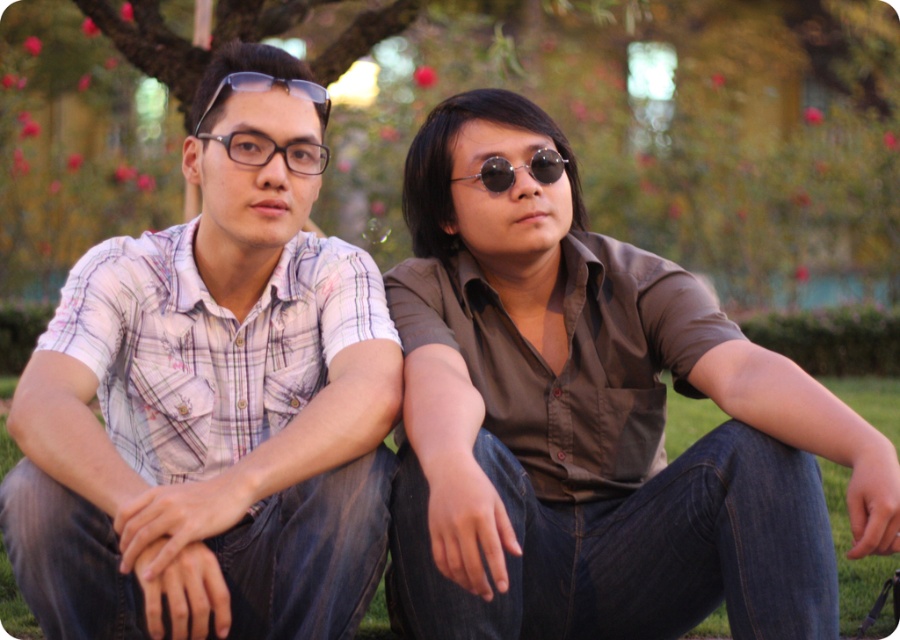
You are a photographer setting up a shot of two people sitting on the green grass at center and wearing matte black glasses at center. Which object is closer to the camera lens?

The matte black glasses at center are closer to the camera lens because they are positioned over the green grass at center.

You are a photographer trying to capture a portrait of the two people in the image. You want to ensure both subjects are in focus. Given that the plaid cotton shirt at left and the matte black glasses at center are at different heights, which subject should you adjust your camera focus on to ensure both are sharp?

The plaid cotton shirt at left is much taller than the matte black glasses at center. To ensure both are in focus, adjust the camera focus to the matte black glasses at center since it is closer to the camera, allowing the depth of field to cover the taller subject behind it.